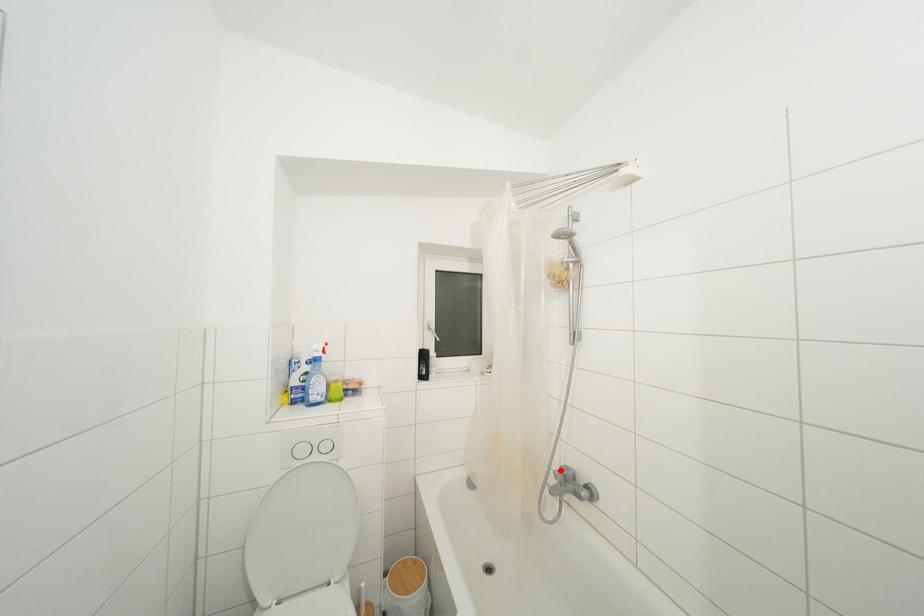
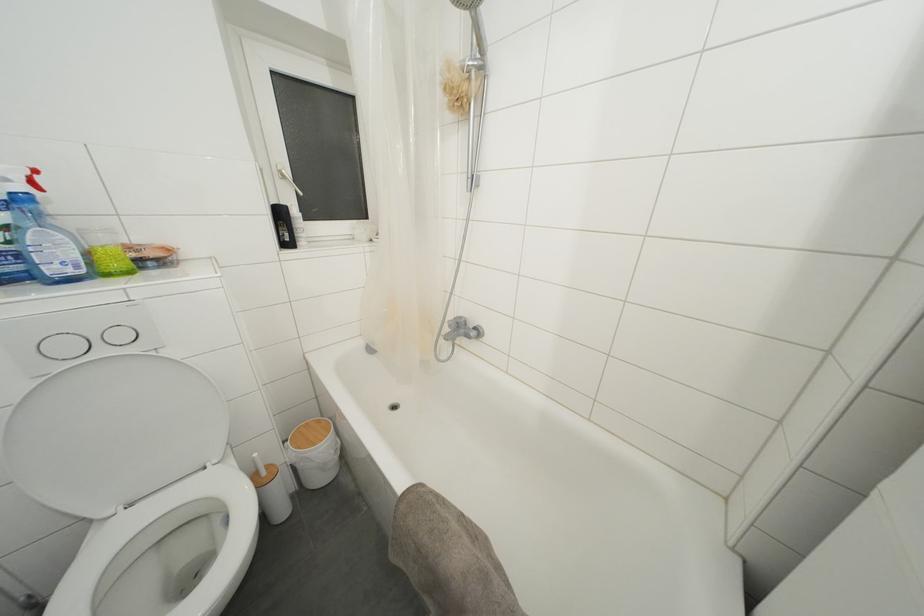
Question: I am providing you with two images of the same scene from different viewpoints. Image1 has a red point marked. In image2, the corresponding 3D location appears at what relative position? Reply with the corresponding letter.

Choices:
 (A) Closer
 (B) Farther

Answer: (A)